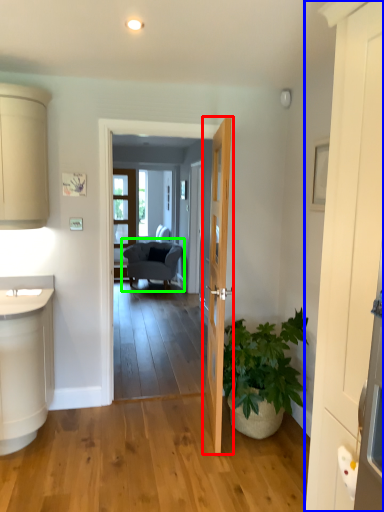
Question: Estimate the real-world distances between objects in this image. Which object is closer to door (highlighted by a red box), door (highlighted by a blue box) or chair (highlighted by a green box)?

Choices:
 (A) door
 (B) chair

Answer: (A)